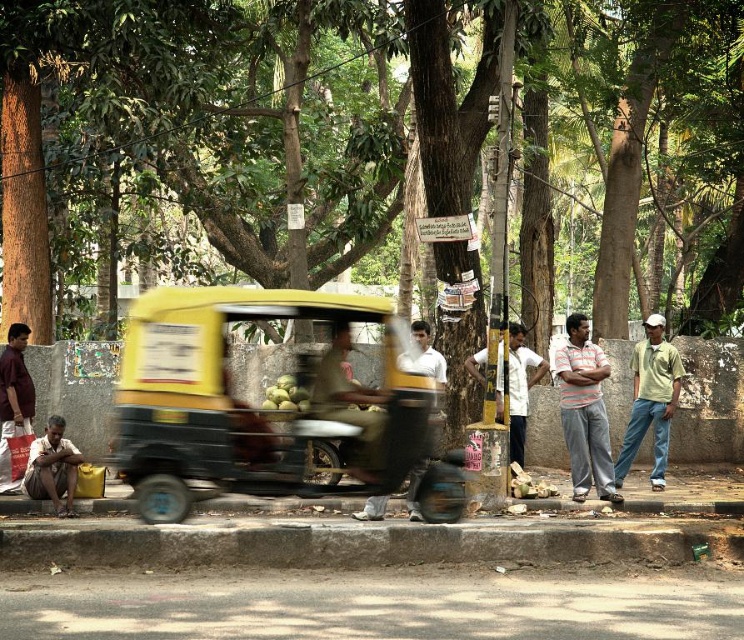
Question: Is gray concrete curb at lower center below white shirt at center?

Choices:
 (A) no
 (B) yes

Answer: (B)

Question: Among these objects, which one is nearest to the camera?

Choices:
 (A) yellow matte auto-rickshaw at center
 (B) brown leather bag at lower left
 (C) green leafy tree at center

Answer: (A)

Question: Which point is farther to the camera?

Choices:
 (A) (606, 451)
 (B) (536, 371)
 (C) (682, 513)

Answer: (B)

Question: Which of the following is the farthest from the observer?

Choices:
 (A) (51, 420)
 (B) (266, 500)
 (C) (530, 378)

Answer: (C)

Question: Can you confirm if striped cotton shirt at center is bigger than concrete curb at lower center?

Choices:
 (A) no
 (B) yes

Answer: (A)

Question: Is yellow matte auto-rickshaw at center further to the viewer compared to brown leather bag at lower left?

Choices:
 (A) yes
 (B) no

Answer: (B)